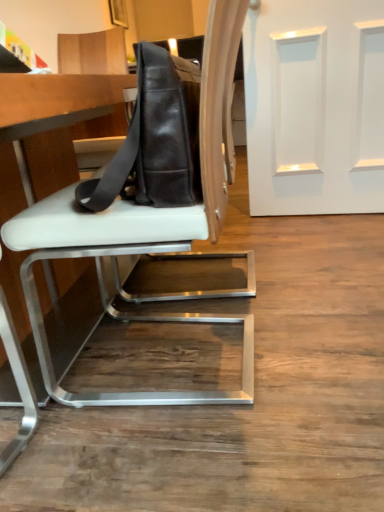
Question: Does black leather messenger bag at center have a larger size compared to white leather chair at center?

Choices:
 (A) yes
 (B) no

Answer: (B)

Question: Is black leather messenger bag at center to the left of white leather chair at center from the viewer's perspective?

Choices:
 (A) yes
 (B) no

Answer: (A)

Question: Does black leather messenger bag at center have a lesser height compared to white leather chair at center?

Choices:
 (A) yes
 (B) no

Answer: (A)

Question: Considering the relative sizes of black leather messenger bag at center and white leather chair at center in the image provided, is black leather messenger bag at center thinner than white leather chair at center?

Choices:
 (A) no
 (B) yes

Answer: (B)

Question: Could white leather chair at center be considered to be inside black leather messenger bag at center?

Choices:
 (A) no
 (B) yes

Answer: (A)

Question: Considering the relative sizes of black leather messenger bag at center and white leather chair at center in the image provided, is black leather messenger bag at center taller than white leather chair at center?

Choices:
 (A) yes
 (B) no

Answer: (B)

Question: Is white leather table at center to the right of white smooth door at upper right from the viewer's perspective?

Choices:
 (A) yes
 (B) no

Answer: (B)

Question: Does white leather table at center contain white smooth door at upper right?

Choices:
 (A) yes
 (B) no

Answer: (B)

Question: Is white leather table at center touching white smooth door at upper right?

Choices:
 (A) no
 (B) yes

Answer: (A)

Question: From the image's perspective, is white leather table at center located above white smooth door at upper right?

Choices:
 (A) yes
 (B) no

Answer: (B)

Question: Is white leather table at center positioned before white smooth door at upper right?

Choices:
 (A) no
 (B) yes

Answer: (B)

Question: Is white leather table at center bigger than white smooth door at upper right?

Choices:
 (A) yes
 (B) no

Answer: (A)

Question: From a real-world perspective, is white smooth door at upper right on black leather messenger bag at center?

Choices:
 (A) yes
 (B) no

Answer: (B)